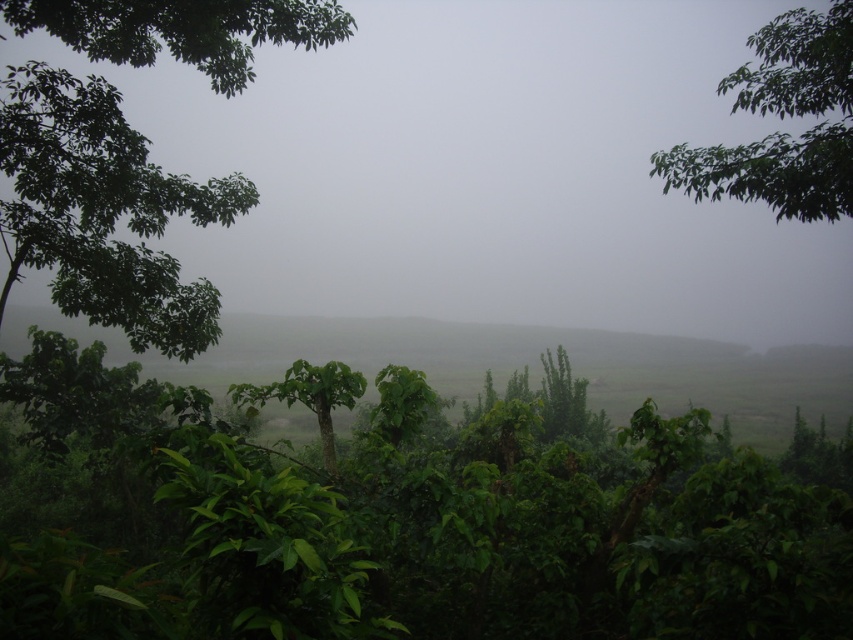
You are standing in the misty landscape described. You want to place a small marker exactly at the center of the image. Is the green leafy vegetation at center located closer to the marker or further away from it?

The green leafy vegetation at center is located at point (404, 513), which is further away from the exact center of the image. Therefore, it is not at the marker location.

You are a hiker navigating through the misty landscape. You see the foggy mist at center and the green leafy tree at left. Which object is closer to the ground?

The foggy mist at center is positioned under green leafy tree at left, so the foggy mist at center is closer to the ground.